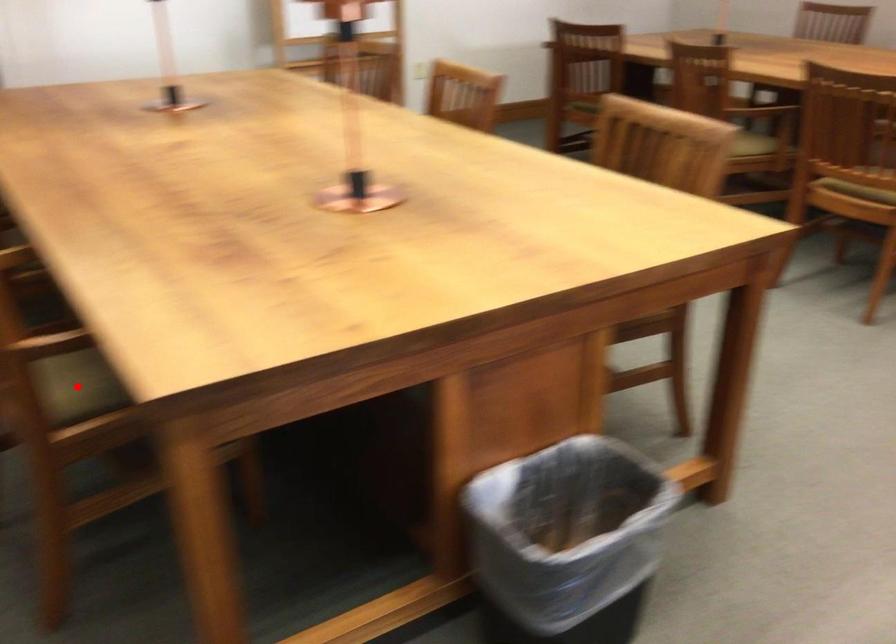
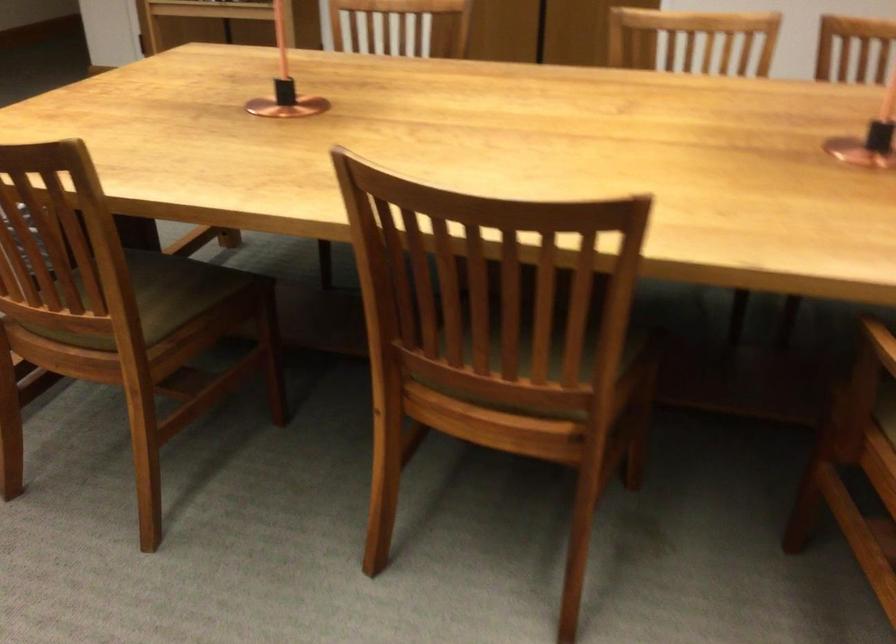
Question: I am providing you with two images of the same scene from different viewpoints. A red point is marked on the first image. At the location where the point appears in image 1, is it still visible in image 2?

Choices:
 (A) Yes
 (B) No

Answer: (B)